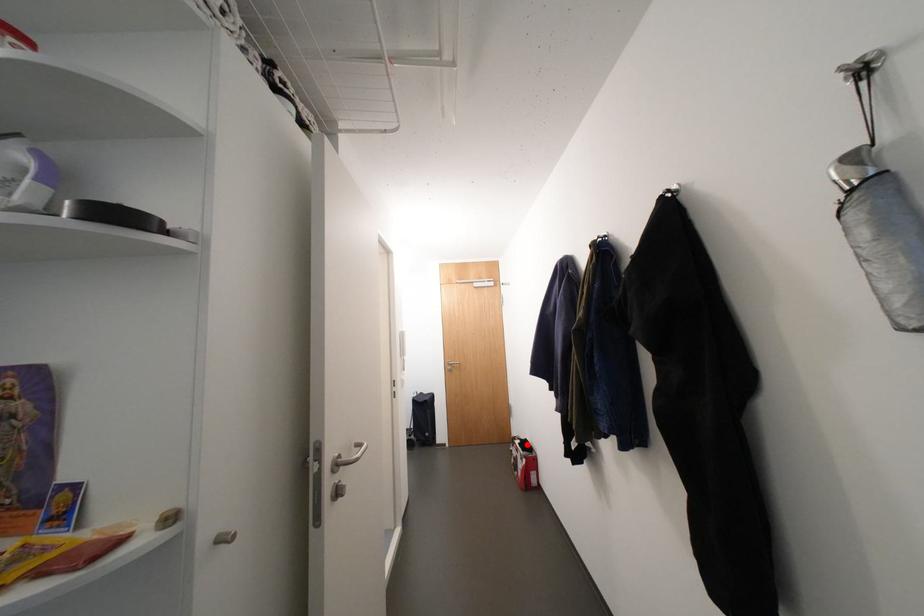
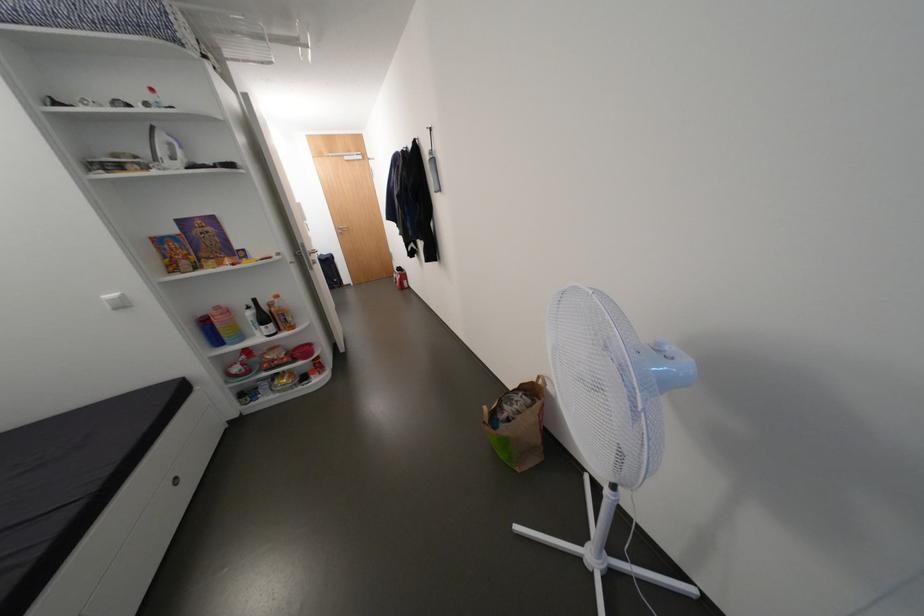
Question: I am providing you with two images of the same scene from different viewpoints. Given a red point in image1, look at the same physical point in image2. Is it:

Choices:
 (A) Closer to the viewpoint
 (B) Farther from the viewpoint

Answer: (A)